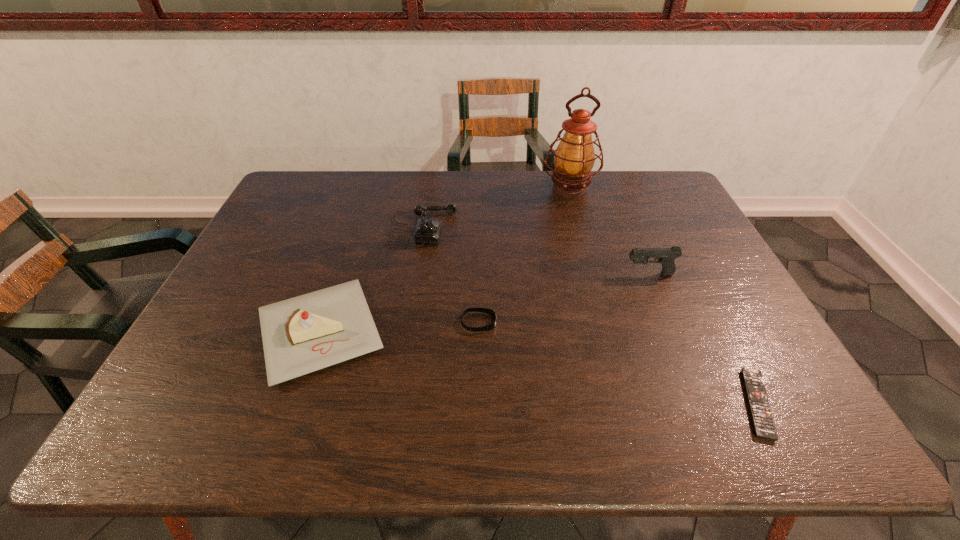
What are the coordinates of `object present at the left edge` in the screenshot? It's located at (300, 335).

Image resolution: width=960 pixels, height=540 pixels. Identify the location of pistol located in the right edge section of the desktop. (666, 256).

Locate an element on the screen. remote control present at the right edge is located at coordinates (764, 427).

Identify the location of object that is at the near right corner. (764, 427).

The height and width of the screenshot is (540, 960). In the image, there is a desktop. In order to click on vacant space at the far edge in this screenshot , I will do `click(536, 191)`.

In the image, there is a desktop. Identify the location of blank space at the left edge. click(x=282, y=233).

Where is `vacant area at the far left corner of the desktop`? The width and height of the screenshot is (960, 540). vacant area at the far left corner of the desktop is located at coordinates point(320,195).

In the image, there is a desktop. Where is `free space at the far right corner`? This screenshot has width=960, height=540. free space at the far right corner is located at coordinates (631, 182).

Where is `free space between the fourth object from right to left and the oil lamp`? Image resolution: width=960 pixels, height=540 pixels. free space between the fourth object from right to left and the oil lamp is located at coordinates (524, 255).

At what (x,y) coordinates should I click in order to perform the action: click on vacant space that's between the pistol and the fifth nearest object. Please return your answer as a coordinate pair (x, y). This screenshot has width=960, height=540. Looking at the image, I should click on 536,251.